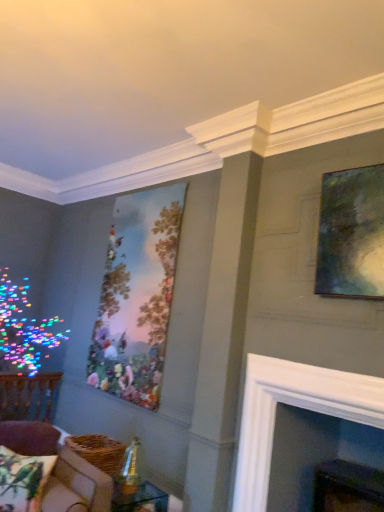
Question: Is printed fabric pillow with parrots at lower left with clear glass table at lower center?

Choices:
 (A) yes
 (B) no

Answer: (B)

Question: Is printed fabric pillow with parrots at lower left wider than clear glass table at lower center?

Choices:
 (A) yes
 (B) no

Answer: (B)

Question: Is printed fabric pillow with parrots at lower left closer to the viewer compared to clear glass table at lower center?

Choices:
 (A) no
 (B) yes

Answer: (B)

Question: Is printed fabric pillow with parrots at lower left aimed at clear glass table at lower center?

Choices:
 (A) no
 (B) yes

Answer: (A)

Question: Considering the relative positions of printed fabric pillow with parrots at lower left and clear glass table at lower center in the image provided, is printed fabric pillow with parrots at lower left to the right of clear glass table at lower center from the viewer's perspective?

Choices:
 (A) yes
 (B) no

Answer: (B)

Question: Does printed fabric pillow with parrots at lower left have a greater height compared to clear glass table at lower center?

Choices:
 (A) no
 (B) yes

Answer: (B)

Question: Considering the relative sizes of white glossy fireplace at center and printed fabric pillow with parrots at lower left in the image provided, is white glossy fireplace at center bigger than printed fabric pillow with parrots at lower left?

Choices:
 (A) yes
 (B) no

Answer: (A)

Question: Does white glossy fireplace at center turn towards printed fabric pillow with parrots at lower left?

Choices:
 (A) yes
 (B) no

Answer: (B)

Question: Does white glossy fireplace at center lie in front of printed fabric pillow with parrots at lower left?

Choices:
 (A) no
 (B) yes

Answer: (B)

Question: Considering the relative positions of white glossy fireplace at center and printed fabric pillow with parrots at lower left in the image provided, is white glossy fireplace at center to the left of printed fabric pillow with parrots at lower left from the viewer's perspective?

Choices:
 (A) yes
 (B) no

Answer: (B)

Question: Would you consider white glossy fireplace at center to be distant from printed fabric pillow with parrots at lower left?

Choices:
 (A) no
 (B) yes

Answer: (B)

Question: From a real-world perspective, is white glossy fireplace at center located higher than printed fabric pillow with parrots at lower left?

Choices:
 (A) no
 (B) yes

Answer: (B)

Question: Is velvet brown couch at lower left thinner than metallic green painting at upper right, marked as the 2th picture frame in a left-to-right arrangement?

Choices:
 (A) yes
 (B) no

Answer: (B)